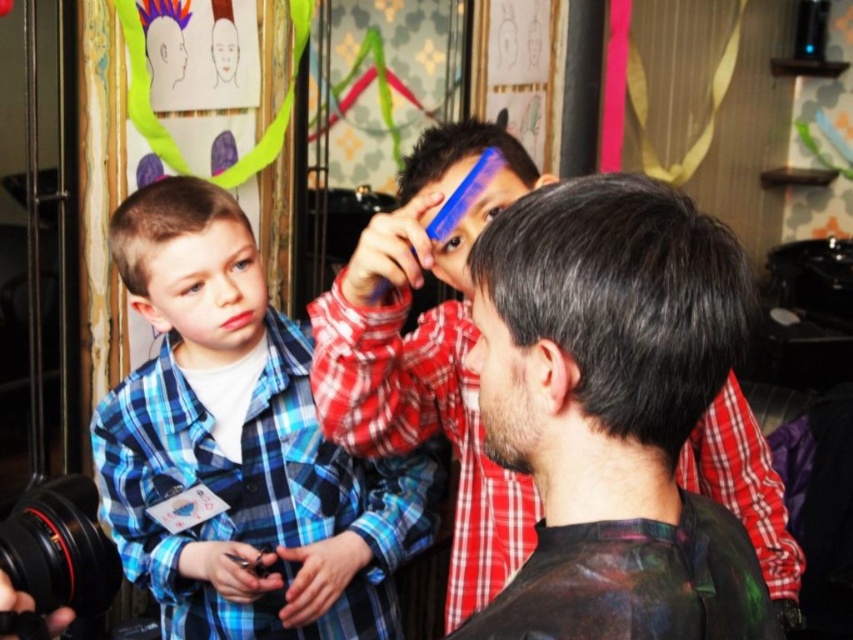
You are a stylist trying to style the short brown hair at left. The blue plastic comb at upper center is within reach. Which direction should you move the comb to start styling the hair?

The short brown hair at left is located below the blue plastic comb at upper center, so you should move the comb downward to start styling the hair.

You are a stylist trying to choose between two items to use on a client. You have the short brown hair at left and the blue plastic comb at upper center. Which item takes up more space?

The blue plastic comb at upper center takes up more space than the short brown hair at left because the short brown hair at left occupies less space than blue plastic comb at upper center.